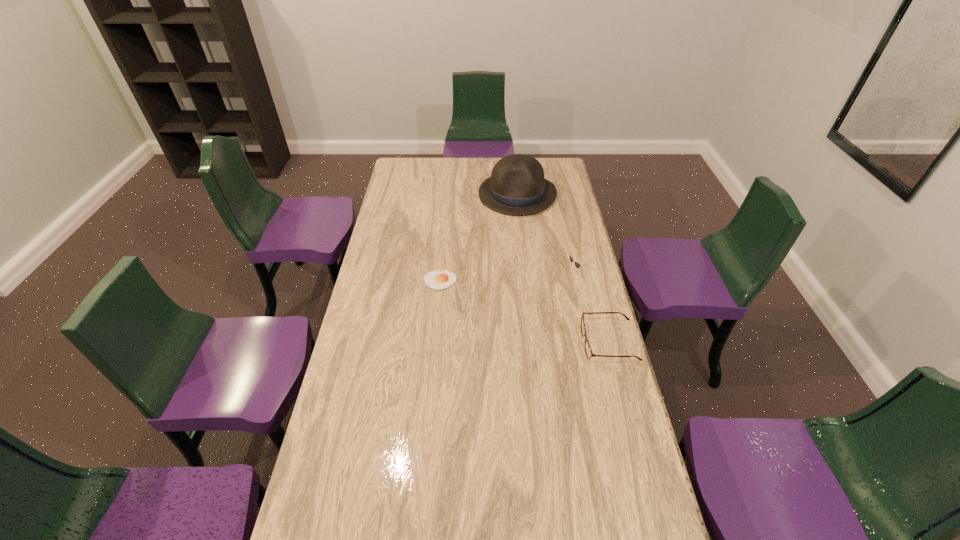
Where is `the closest object to the sunglasses`? the closest object to the sunglasses is located at coordinates (588, 351).

At what (x,y) coordinates should I click in order to perform the action: click on vacant area that satisfies the following two spatial constraints: 1. on the back side of the egg yolk; 2. on the right side of the sunglasses. Please return your answer as a coordinate pair (x, y). The width and height of the screenshot is (960, 540). Looking at the image, I should click on (441, 273).

This screenshot has height=540, width=960. Identify the location of blank area in the image that satisfies the following two spatial constraints: 1. on the front side of the tallest object; 2. on the lenses of the second shortest object. (534, 342).

In order to click on free space that satisfies the following two spatial constraints: 1. on the back side of the tallest object; 2. on the left side of the leftmost object in this screenshot , I will do `click(448, 194)`.